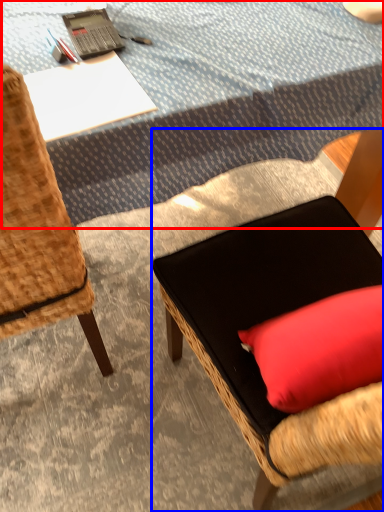
Question: Among these objects, which one is farthest to the camera, tablecloth (highlighted by a red box) or chair (highlighted by a blue box)?

Choices:
 (A) tablecloth
 (B) chair

Answer: (A)